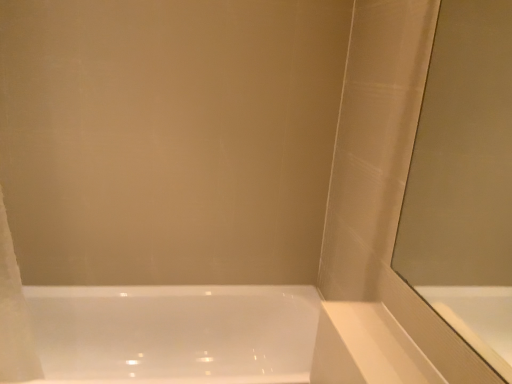
What is the approximate height of white glossy bathtub at lower center?

23.17 inches.

Measure the distance between point (293,358) and camera.

Point (293,358) and camera are 2.03 meters apart from each other.

Describe the element at coordinates (216, 336) in the screenshot. The height and width of the screenshot is (384, 512). I see `white glossy bathtub at lower center` at that location.

Locate an element on the screen. The height and width of the screenshot is (384, 512). white glossy bathtub at lower center is located at coordinates click(216, 336).

This screenshot has width=512, height=384. What are the coordinates of `white glossy bathtub at lower center` in the screenshot? It's located at (216, 336).